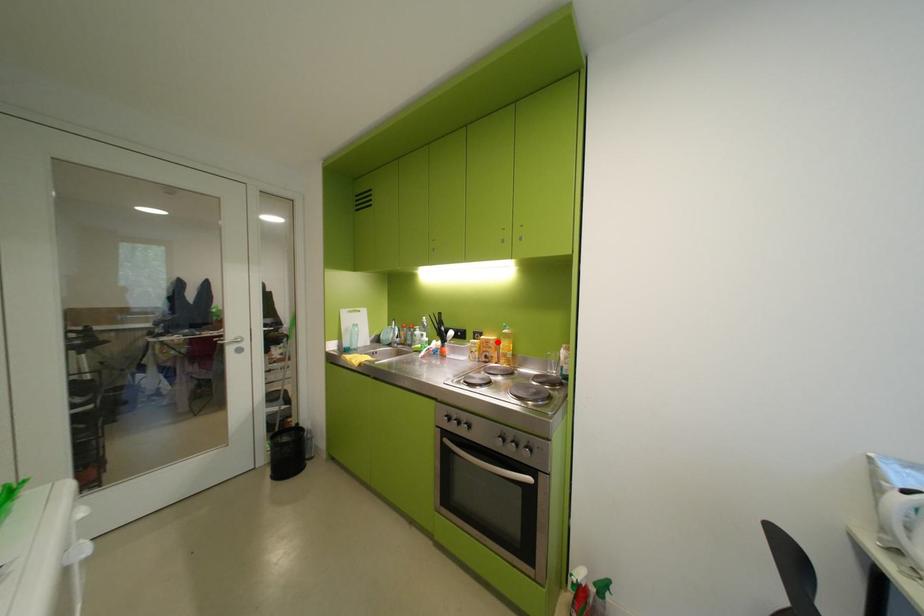
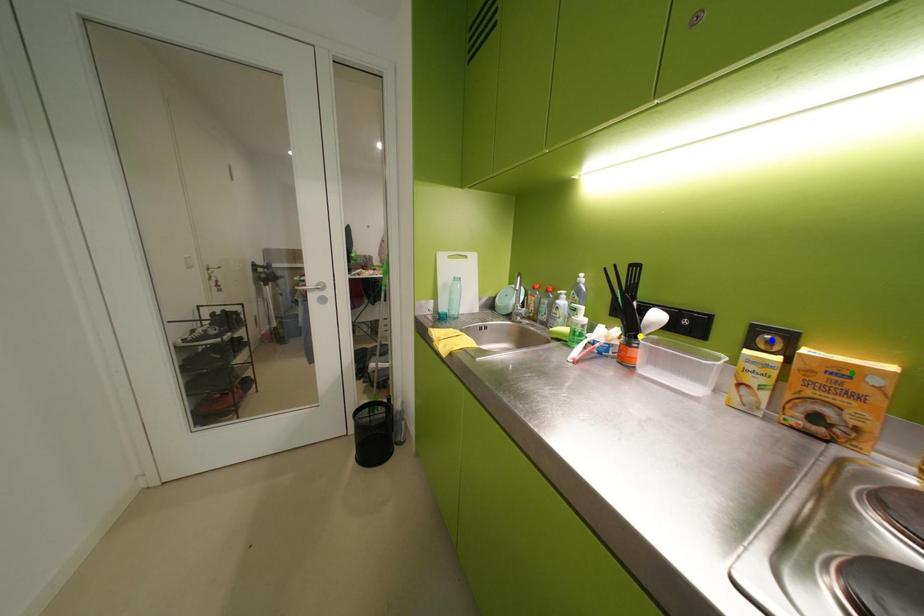
Question: I am providing you with two images of the same scene from different viewpoints. A red point is marked on the first image. You are given multiple points on the second image. Can you choose the point in image 2 that corresponds to the point in image 1?

Choices:
 (A) green point
 (B) yellow point
 (C) blue point

Answer: (A)